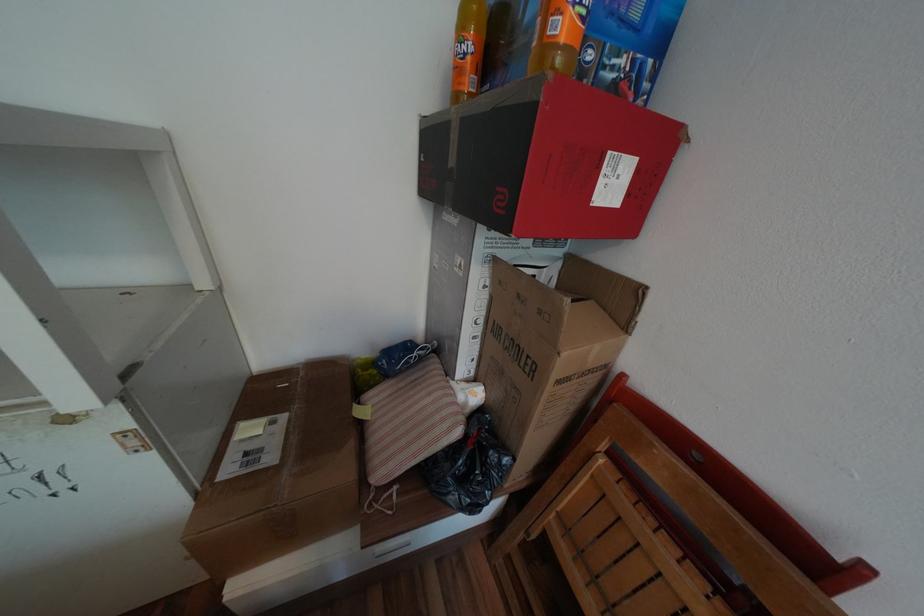
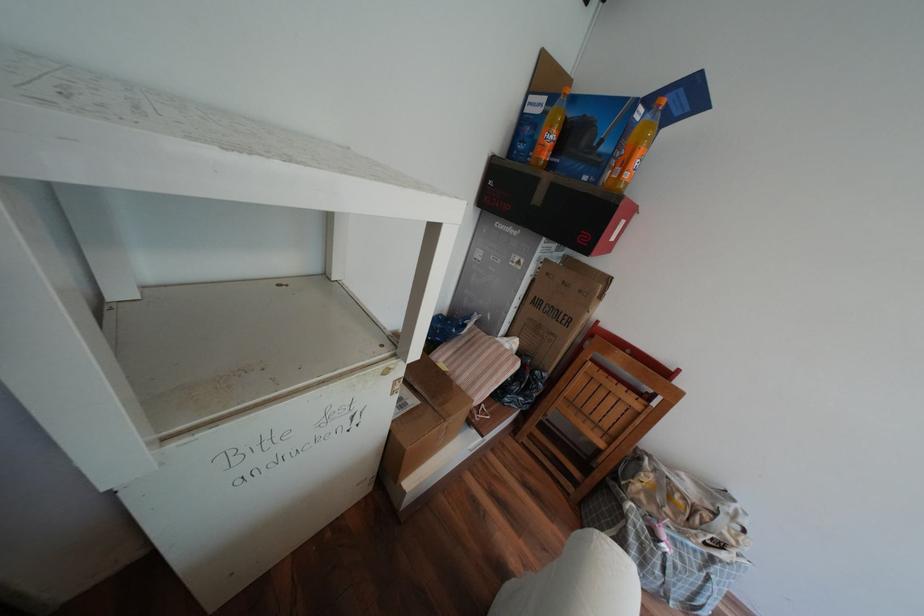
Find the pixel in the second image that matches point 472,31 in the first image.

(561, 127)